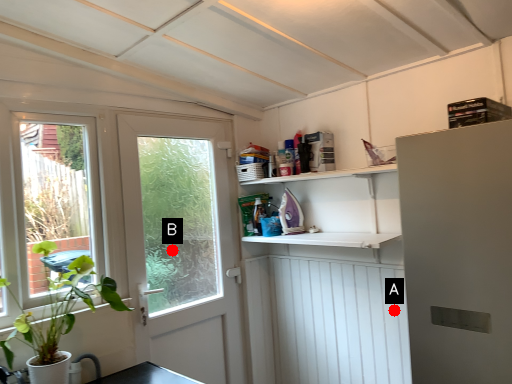
Question: Two points are circled on the image, labeled by A and B beside each circle. Among these points, which one is nearest to the camera?

Choices:
 (A) A is closer
 (B) B is closer

Answer: (A)